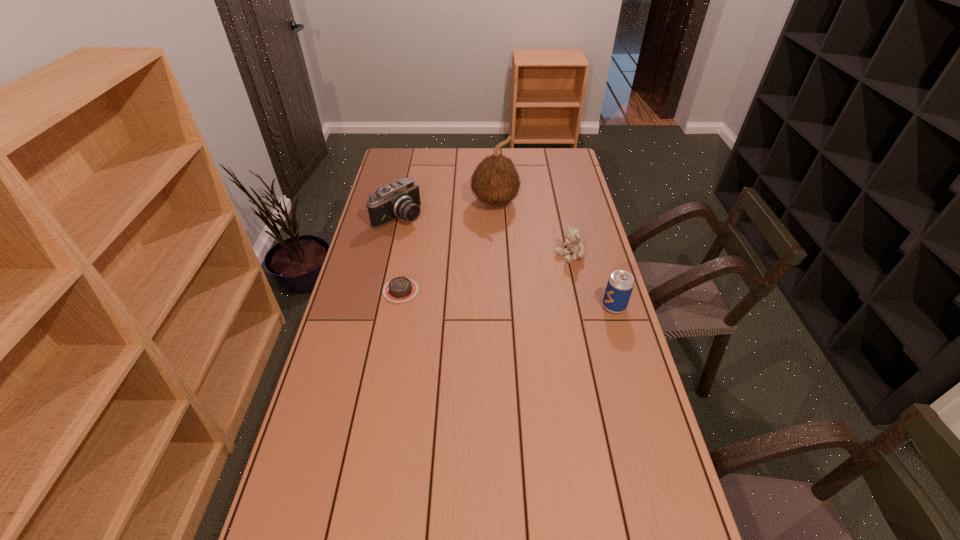
At what (x,y) coordinates should I click in order to perform the action: click on beer can that is positioned at the right edge. Please return your answer as a coordinate pair (x, y). Looking at the image, I should click on click(620, 284).

Locate an element on the screen. teddy bear that is at the right edge is located at coordinates (576, 247).

Locate an element on the screen. Image resolution: width=960 pixels, height=540 pixels. vacant area at the far edge of the desktop is located at coordinates (452, 160).

In order to click on free region at the near edge of the desktop in this screenshot , I will do `click(451, 533)`.

Find the location of a particular element. vacant space at the left edge is located at coordinates [357, 434].

Identify the location of free location at the right edge. (570, 277).

The width and height of the screenshot is (960, 540). In the image, there is a desktop. In order to click on vacant space at the far left corner in this screenshot , I will do `click(389, 154)`.

In the image, there is a desktop. Where is `vacant space at the near left corner`? vacant space at the near left corner is located at coordinates (300, 502).

The width and height of the screenshot is (960, 540). I want to click on blank region between the camera and the third object from left to right, so click(x=446, y=210).

At what (x,y) coordinates should I click in order to perform the action: click on empty space that is in between the third farthest object and the shortest object. Please return your answer as a coordinate pair (x, y). The height and width of the screenshot is (540, 960). Looking at the image, I should click on (486, 273).